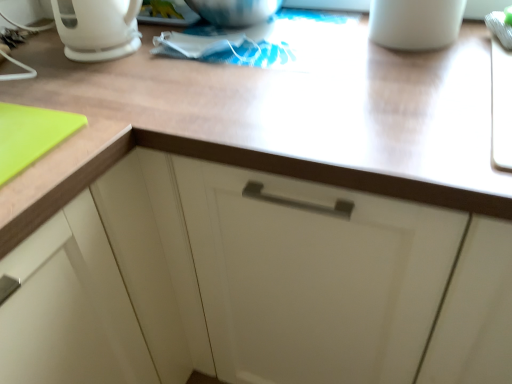
The width and height of the screenshot is (512, 384). In order to click on free space in front of white matte mug at upper right in this screenshot , I will do `click(433, 66)`.